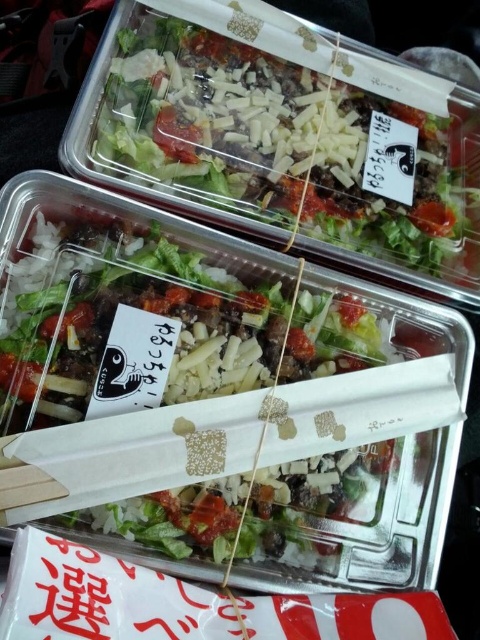
Does shiny plastic salad at center have a smaller size compared to translucent plastic salad at upper center?

Incorrect, shiny plastic salad at center is not smaller in size than translucent plastic salad at upper center.

What do you see at coordinates (206, 392) in the screenshot? Image resolution: width=480 pixels, height=640 pixels. I see `shiny plastic salad at center` at bounding box center [206, 392].

Locate an element on the screen. This screenshot has height=640, width=480. shiny plastic salad at center is located at coordinates (206, 392).